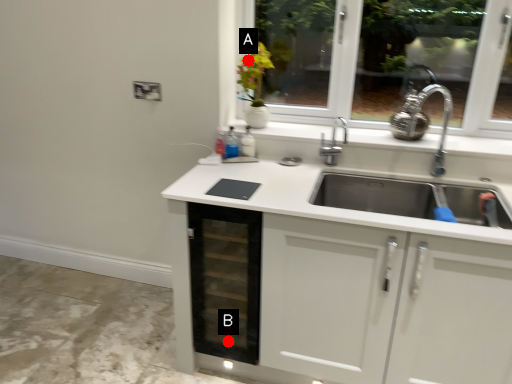
Question: Two points are circled on the image, labeled by A and B beside each circle. Which point is closer to the camera taking this photo?

Choices:
 (A) A is closer
 (B) B is closer

Answer: (B)